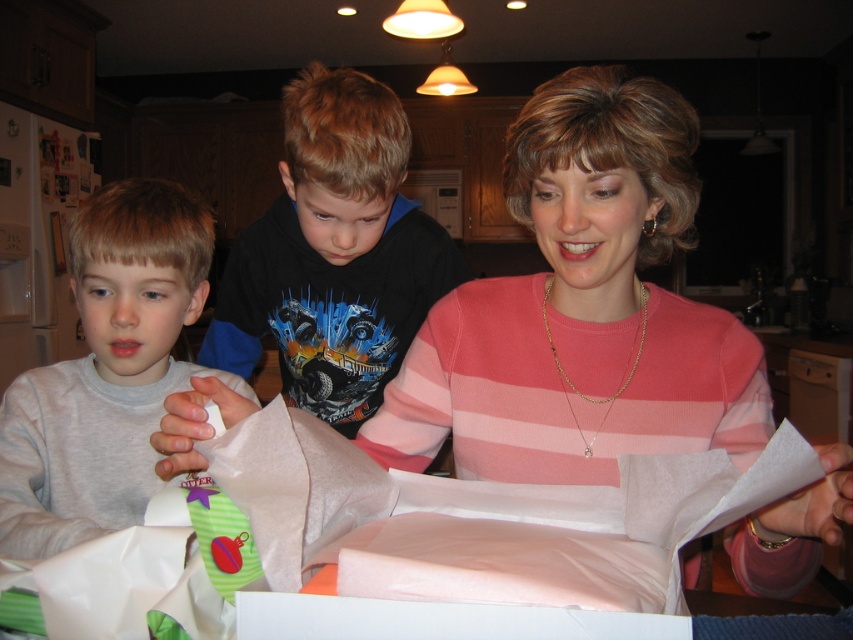
Question: Among these points, which one is farthest from the camera?

Choices:
 (A) (634, 369)
 (B) (140, 480)

Answer: (B)

Question: In this image, where is black cotton shirt at center located relative to gray cotton shirt at left?

Choices:
 (A) right
 (B) left

Answer: (A)

Question: Which point is farther from the camera taking this photo?

Choices:
 (A) (314, 173)
 (B) (132, 314)
 (C) (751, 561)

Answer: (A)

Question: Observing the image, what is the correct spatial positioning of black cotton shirt at center in reference to gray cotton shirt at left?

Choices:
 (A) left
 (B) right

Answer: (B)

Question: Can you confirm if black cotton shirt at center is positioned to the left of gray cotton shirt at left?

Choices:
 (A) no
 (B) yes

Answer: (A)

Question: Which object is positioned closest to the gray cotton shirt at left?

Choices:
 (A) pink striped sweater at center
 (B) black cotton shirt at center

Answer: (B)